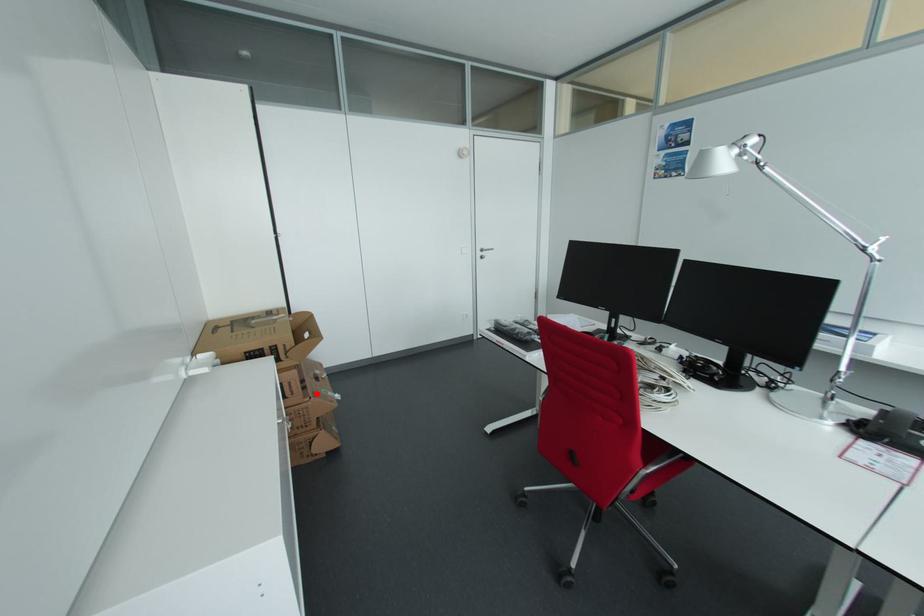
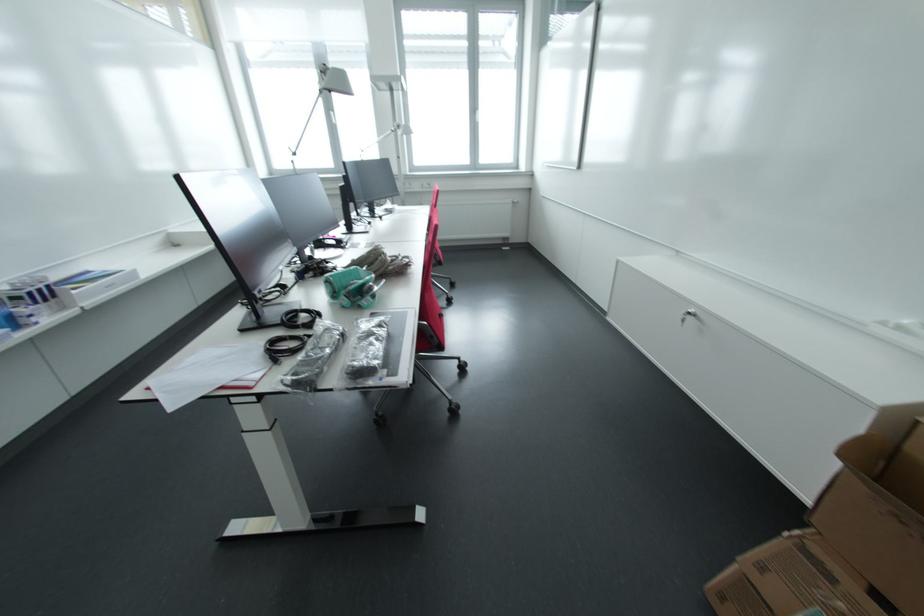
Question: I am providing you with two images of the same scene from different viewpoints. A red point is shown in image1. For the corresponding object point in image2, is it positioned nearer or farther from the camera?

Choices:
 (A) Nearer
 (B) Farther

Answer: (B)